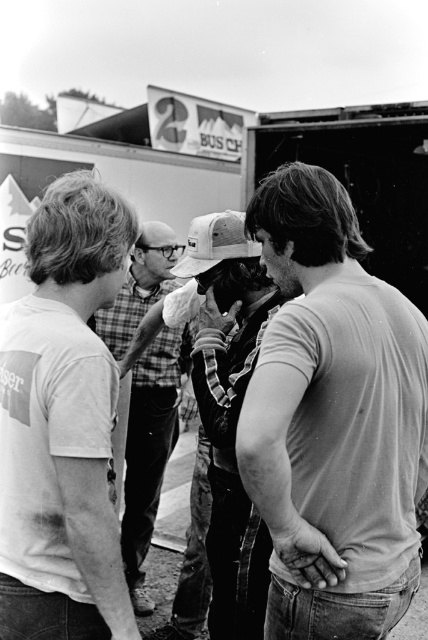
Question: Observing the image, what is the correct spatial positioning of denim jacket at center in reference to plaid shirt at center?

Choices:
 (A) left
 (B) right

Answer: (B)

Question: Does smooth white t-shirt at center appear over denim jacket at center?

Choices:
 (A) yes
 (B) no

Answer: (A)

Question: Does smooth white t-shirt at center have a larger size compared to white cotton t-shirt at left?

Choices:
 (A) yes
 (B) no

Answer: (A)

Question: Which object is the closest to the plaid shirt at center?

Choices:
 (A) white cotton t-shirt at left
 (B) denim jacket at center
 (C) smooth white t-shirt at center

Answer: (B)

Question: Among these points, which one is farthest from the camera?

Choices:
 (A) (9, 598)
 (B) (372, 531)
 (C) (186, 337)
 (D) (241, 595)

Answer: (C)

Question: Which point is closer to the camera?

Choices:
 (A) (x=219, y=342)
 (B) (x=365, y=481)
 (C) (x=83, y=577)
 (D) (x=130, y=332)

Answer: (C)